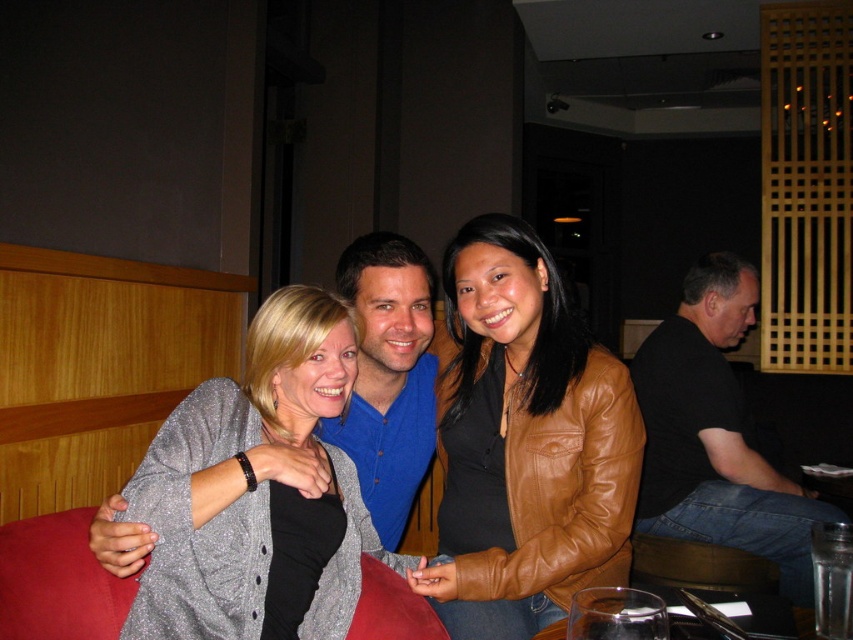
Question: Estimate the real-world distances between objects in this image. Which object is farther from the brown leather jacket at center?

Choices:
 (A) transparent glass at lower center
 (B) sparkly gray cardigan at center

Answer: (A)

Question: Does sparkly gray cardigan at center come in front of black cotton shirt at right?

Choices:
 (A) no
 (B) yes

Answer: (B)

Question: Does brown leather jacket at center appear under transparent glass at lower center?

Choices:
 (A) no
 (B) yes

Answer: (A)

Question: Based on their relative distances, which object is farther from the sparkly gray cardigan at center?

Choices:
 (A) brown leather jacket at center
 (B) transparent glass at lower center

Answer: (B)

Question: Does brown leather jacket at center have a lesser width compared to sparkly gray cardigan at center?

Choices:
 (A) no
 (B) yes

Answer: (B)

Question: Among these objects, which one is nearest to the camera?

Choices:
 (A) sparkly gray cardigan at center
 (B) brown leather jacket at center

Answer: (A)